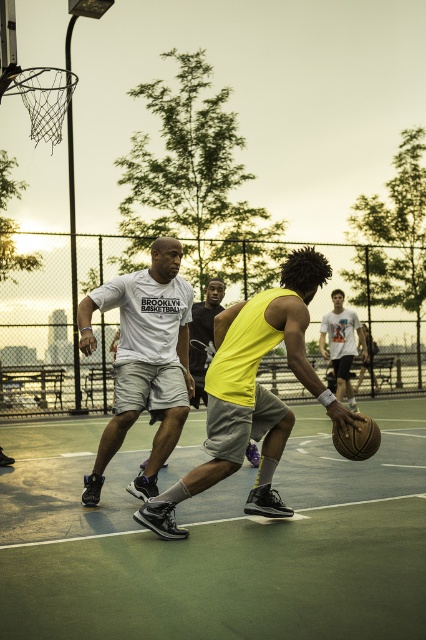
Question: Is metallic silver basketball hoop at upper left positioned in front of shiny brown basketball at center?

Choices:
 (A) no
 (B) yes

Answer: (A)

Question: Among these objects, which one is nearest to the camera?

Choices:
 (A) white matte t-shirt at center
 (B) green rubber basketball court at center
 (C) white t-shirt at center
 (D) shiny brown basketball at center

Answer: (B)

Question: Which of the following is the closest to the observer?

Choices:
 (A) metallic silver basketball hoop at upper left
 (B) white t-shirt at center
 (C) shiny brown basketball at center
 (D) white matte t-shirt at center

Answer: (C)

Question: Where is white matte t-shirt at center located in relation to white t-shirt at center in the image?

Choices:
 (A) right
 (B) left

Answer: (B)

Question: Can you confirm if shiny yellow basketball at center is thinner than white t-shirt at center?

Choices:
 (A) no
 (B) yes

Answer: (A)

Question: Which object appears farthest from the camera in this image?

Choices:
 (A) metallic silver basketball hoop at upper left
 (B) white t-shirt at center
 (C) shiny brown basketball at center

Answer: (B)